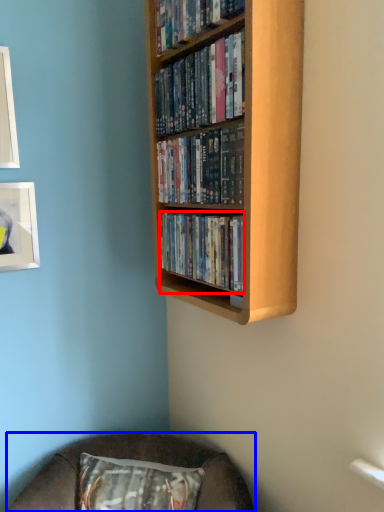
Question: Among these objects, which one is farthest to the camera, book (highlighted by a red box) or furniture (highlighted by a blue box)?

Choices:
 (A) book
 (B) furniture

Answer: (B)